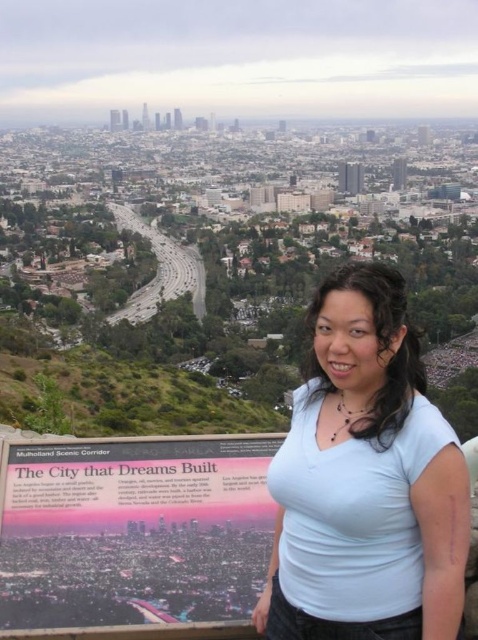
Can you confirm if light blue fabric at center is thinner than pink paper sign at center?

Yes.

What do you see at coordinates (366, 481) in the screenshot?
I see `light blue fabric at center` at bounding box center [366, 481].

Image resolution: width=478 pixels, height=640 pixels. Identify the location of light blue fabric at center. (366, 481).